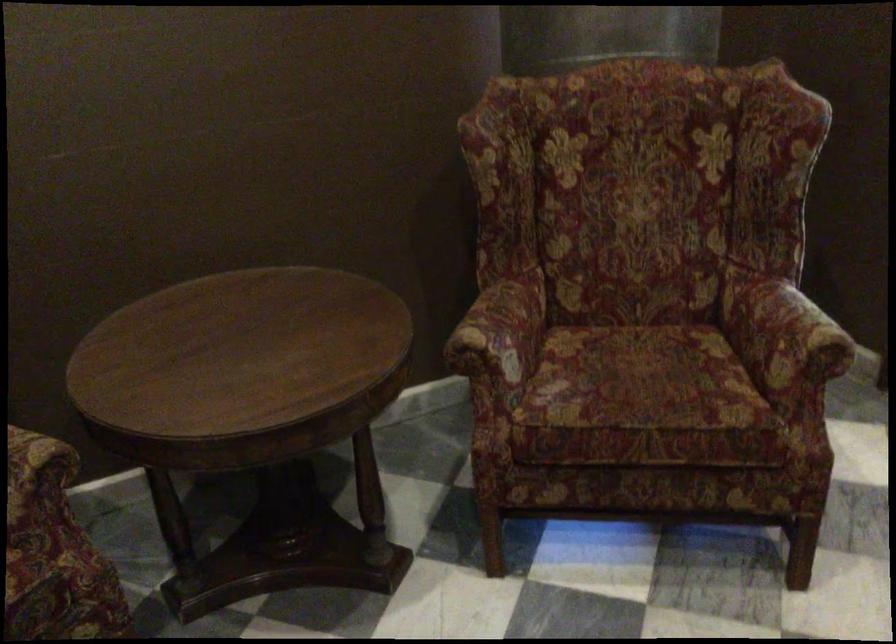
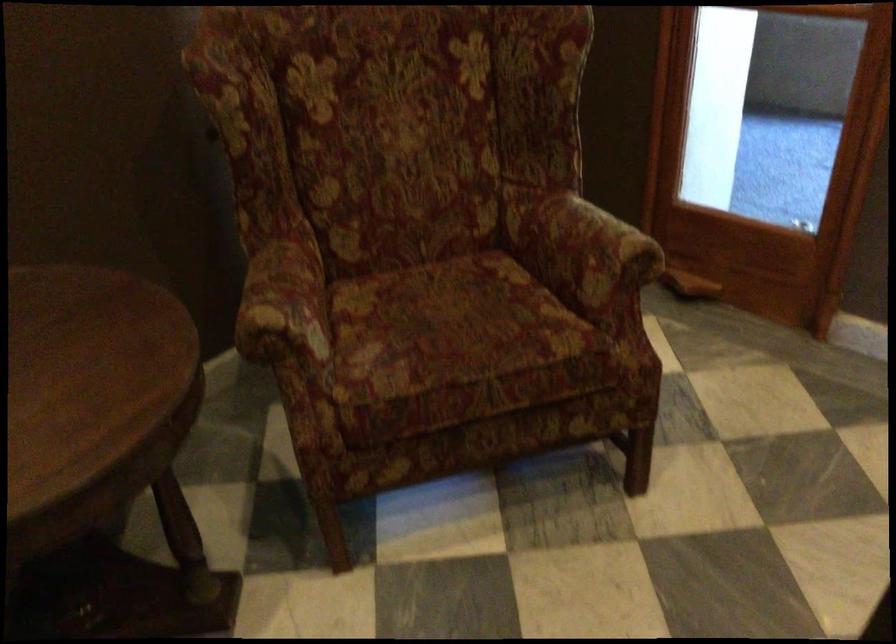
Question: How did the camera likely rotate?

Choices:
 (A) Left
 (B) Right
 (C) Up
 (D) Down

Answer: (B)